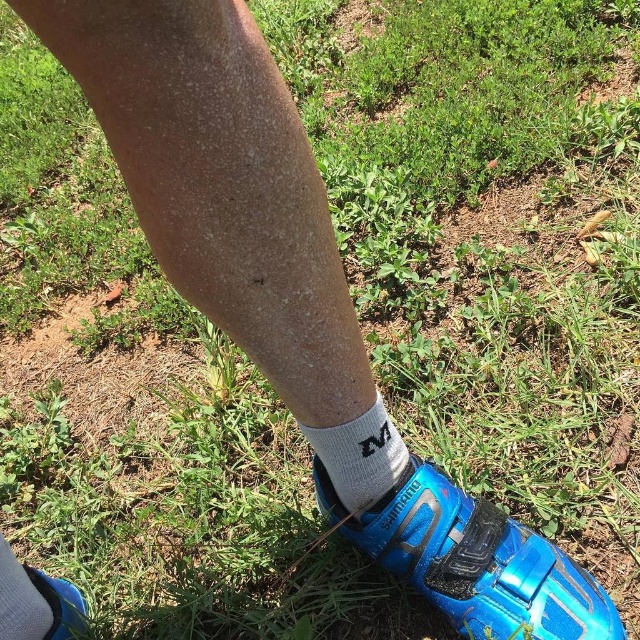
Question: Does blue matte shoe at lower center come behind white cotton sock at lower left?

Choices:
 (A) no
 (B) yes

Answer: (A)

Question: Among these objects, which one is farthest from the camera?

Choices:
 (A) blue matte shoe at lower center
 (B) blue matte shoe at lower right
 (C) white cotton sock at lower left
 (D) white cotton sock at lower center

Answer: (B)

Question: Which point appears farthest from the camera in this image?

Choices:
 (A) (372, 435)
 (B) (80, 624)
 (C) (342, 506)
 (D) (28, 618)

Answer: (B)

Question: Is blue matte shoe at lower center to the right of blue matte shoe at lower right from the viewer's perspective?

Choices:
 (A) no
 (B) yes

Answer: (B)

Question: Which of the following is the closest to the observer?

Choices:
 (A) white cotton sock at lower center
 (B) blue matte shoe at lower center
 (C) blue matte shoe at lower right
 (D) white cotton sock at lower left

Answer: (A)

Question: Observing the image, what is the correct spatial positioning of blue matte shoe at lower center in reference to white cotton sock at lower center?

Choices:
 (A) above
 (B) below

Answer: (B)